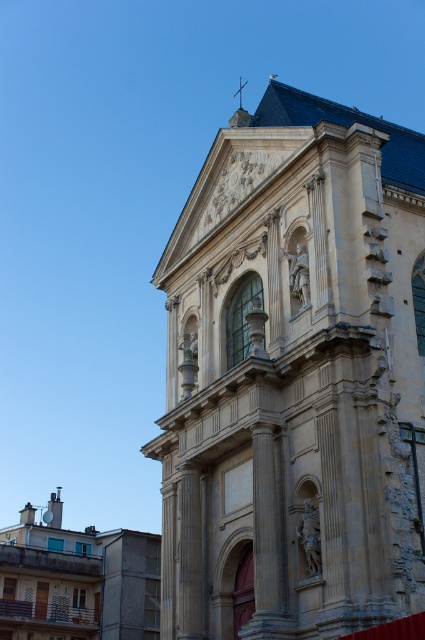
You are standing in front of a grand classical building. You see a point marked at coordinates [294,378]. Based on the scene description, can you identify what object this point is pointing to?

The point at coordinates [294,378] corresponds to the beige stone church at center.

You are standing in front of the beige stone church at center and want to walk to the matte stone church at lower left. Which direction should you face to move towards it?

You should face the lower left direction to move towards the matte stone church at lower left from the beige stone church at center.

You are standing in front of the grand classical building and want to determine the relative positions of two points marked on the facade. Which point, point (x=181, y=394) or point (x=53, y=637), is closer to your current position?

Point (x=181, y=394) is closer to the viewer than point (x=53, y=637).